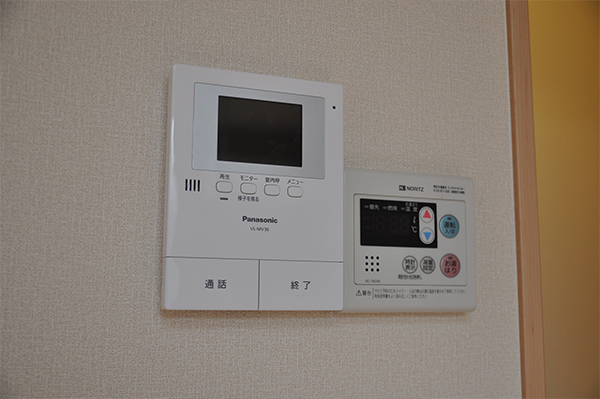
Where is `speaker`? speaker is located at coordinates click(187, 178), click(375, 261).